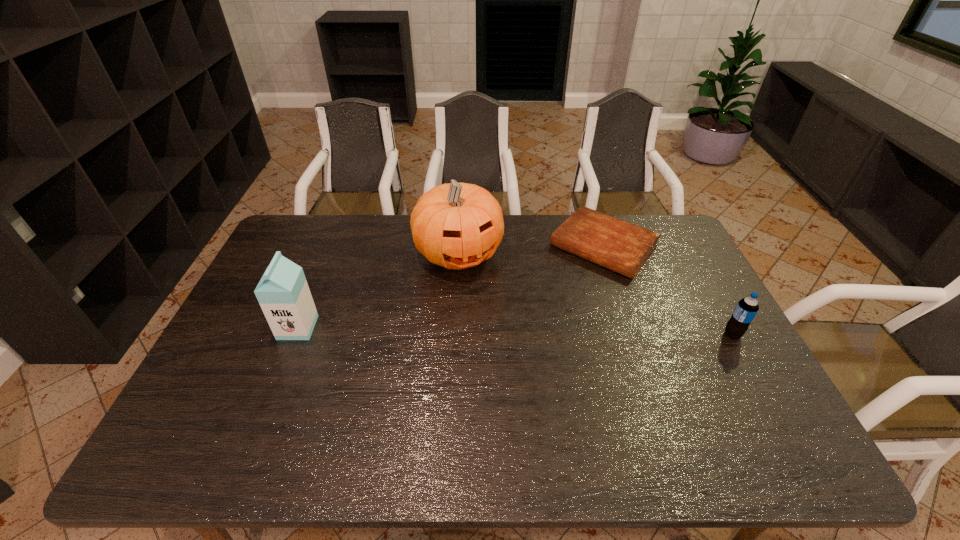
Where is `Bible located in the right edge section of the desktop`? The width and height of the screenshot is (960, 540). Bible located in the right edge section of the desktop is located at coordinates point(620,246).

Where is `object situated at the far right corner`? object situated at the far right corner is located at coordinates (620, 246).

The height and width of the screenshot is (540, 960). In the image, there is a desktop. What are the coordinates of `vacant space at the far edge` in the screenshot? It's located at (348, 219).

Identify the location of free spot at the near edge of the desktop. The width and height of the screenshot is (960, 540). (680, 410).

Find the location of a particular element. blank space at the left edge is located at coordinates (309, 265).

Where is `vacant space at the right edge of the desktop`? Image resolution: width=960 pixels, height=540 pixels. vacant space at the right edge of the desktop is located at coordinates (739, 362).

Locate an element on the screen. This screenshot has width=960, height=540. vacant space at the far left corner of the desktop is located at coordinates (299, 243).

You are a GUI agent. You are given a task and a screenshot of the screen. Output one action in this format:
    pyautogui.click(x=<x>, y=<y>)
    Task: Click on the vacant space at the near left corner of the desktop
    
    Given the screenshot: What is the action you would take?
    pyautogui.click(x=243, y=394)

Identify the location of free space at the near right corner of the desktop. (765, 415).

The width and height of the screenshot is (960, 540). What are the coordinates of `free area in between the third object from right to left and the soda bottle` in the screenshot? It's located at (595, 294).